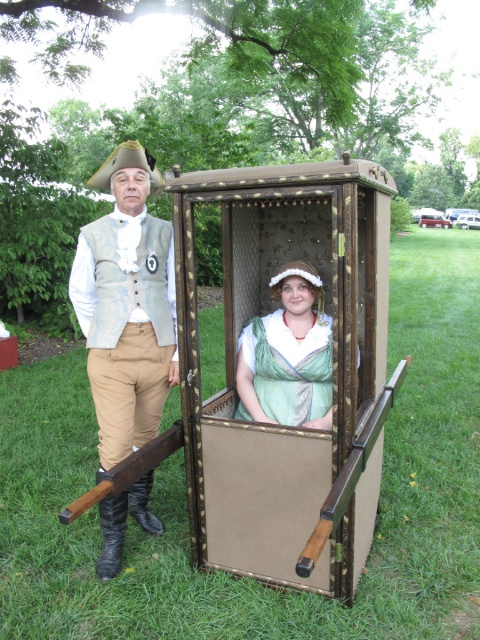
Is point (129, 440) behind point (320, 404)?

Yes, it is.

Which of these two, light brown leather vest at left or green satin dress at center, stands taller?

light brown leather vest at left

Is point (103, 576) positioned in front of point (256, 346)?

Yes, point (103, 576) is in front of point (256, 346).

Where is `light brown leather vest at left`? The height and width of the screenshot is (640, 480). light brown leather vest at left is located at coordinates (127, 307).

Where is `wooden cage at center`? wooden cage at center is located at coordinates (288, 369).

Between wooden cage at center and green satin dress at center, which one is positioned higher?

wooden cage at center

The width and height of the screenshot is (480, 640). I want to click on wooden cage at center, so click(x=288, y=369).

Based on the photo, between wooden cage at center and light brown leather vest at left, which one appears on the left side from the viewer's perspective?

Positioned to the left is light brown leather vest at left.

Which is behind, point (343, 259) or point (143, 225)?

The point (143, 225) is behind.

Where is `wooden cage at center`? Image resolution: width=480 pixels, height=640 pixels. wooden cage at center is located at coordinates (288, 369).